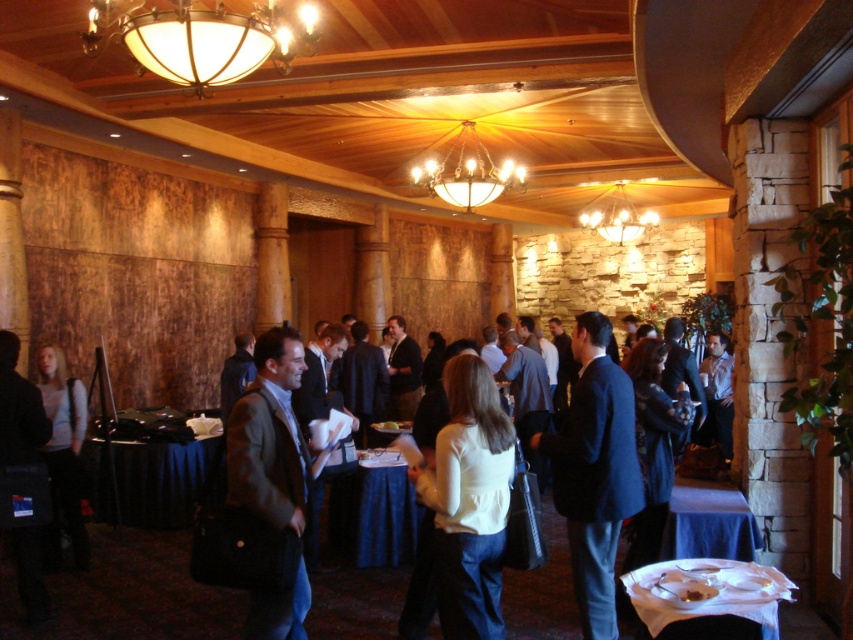
Question: Which point is farther to the camera?

Choices:
 (A) gold metallic chandelier at center
 (B) white glossy table at lower right
 (C) brown leather jacket at center

Answer: (A)

Question: Can you confirm if matte glass chandelier at upper center is positioned to the left of matte gray sweater at center?

Choices:
 (A) no
 (B) yes

Answer: (A)

Question: Which point is closer to the camera?

Choices:
 (A) (33, 545)
 (B) (706, 499)

Answer: (B)

Question: Which of the following is the farthest from the observer?

Choices:
 (A) blue cloth table at lower right
 (B) dark blue tablecloth at lower left
 (C) gold metallic chandelier at center
 (D) matte gray sweater at center

Answer: (C)

Question: Can you confirm if white glossy table at lower right is bigger than matte gray sweater at center?

Choices:
 (A) yes
 (B) no

Answer: (B)

Question: Does white glossy table at lower right appear under matte gray sweater at center?

Choices:
 (A) yes
 (B) no

Answer: (A)